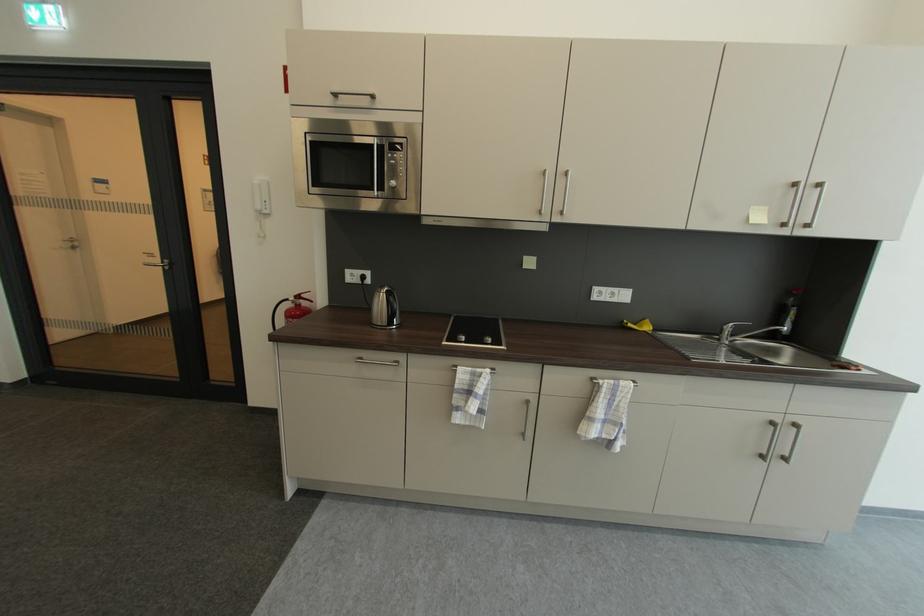
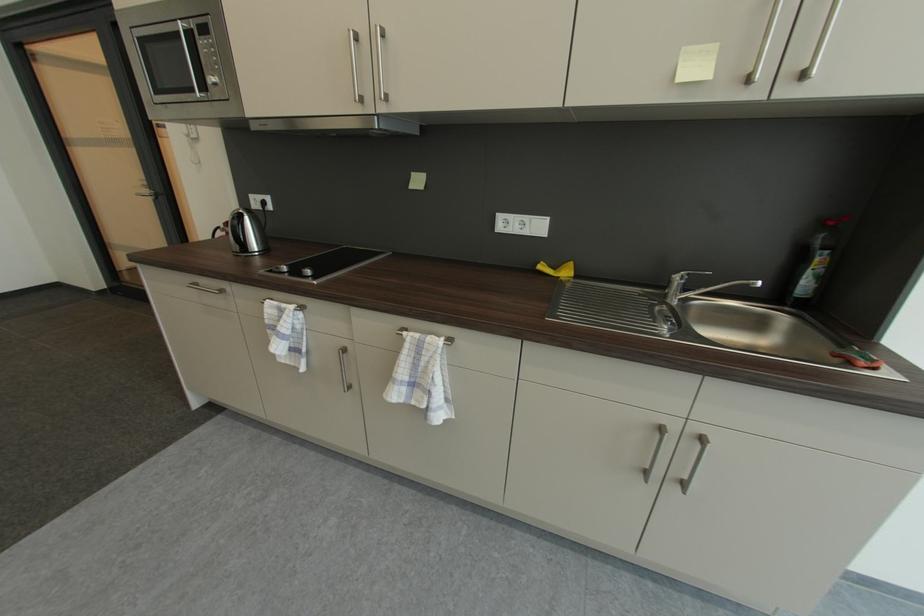
What movement of the cameraman would produce the second image?

The cameraman walked toward right, forward.